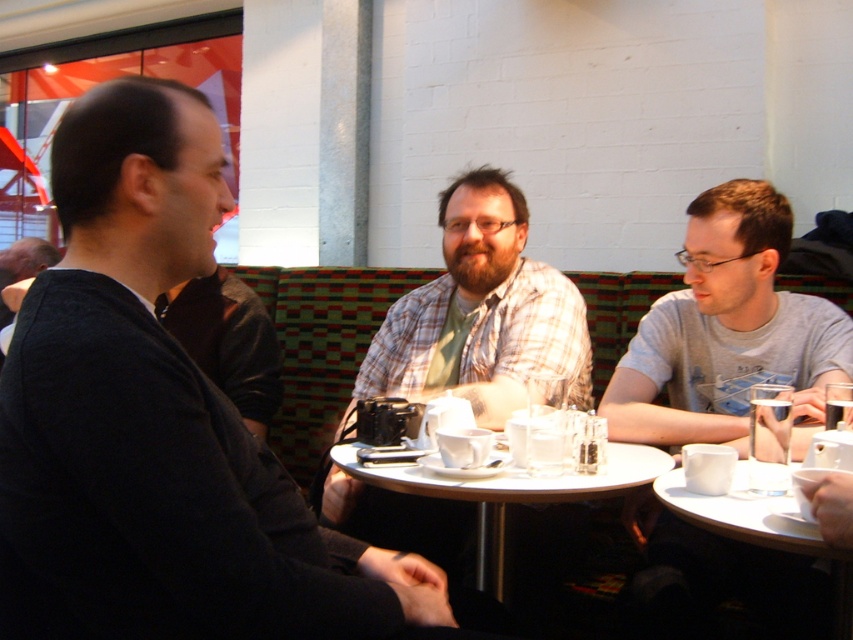
Is dark gray sweater at left positioned at the back of white glossy table at center?

No, dark gray sweater at left is closer to the viewer.

Which is behind, point (219, 404) or point (635, 461)?

Point (635, 461)

Locate an element on the screen. dark gray sweater at left is located at coordinates (160, 420).

Does white glossy table at center have a smaller size compared to white ceramic table at lower right?

Actually, white glossy table at center might be larger than white ceramic table at lower right.

Which is behind, point (402, 488) or point (735, 524)?

Point (402, 488)

Is point (646, 477) less distant than point (790, 528)?

No, (646, 477) is behind (790, 528).

At what (x,y) coordinates should I click in order to perform the action: click on white glossy table at center. Please return your answer as a coordinate pair (x, y). Looking at the image, I should click on (509, 493).

Does gray cotton shirt at right appear on the right side of white ceramic table at lower right?

Yes, gray cotton shirt at right is to the right of white ceramic table at lower right.

Which is above, gray cotton shirt at right or white ceramic table at lower right?

gray cotton shirt at right

What do you see at coordinates (726, 330) in the screenshot? I see `gray cotton shirt at right` at bounding box center [726, 330].

Identify the location of gray cotton shirt at right. This screenshot has width=853, height=640. (726, 330).